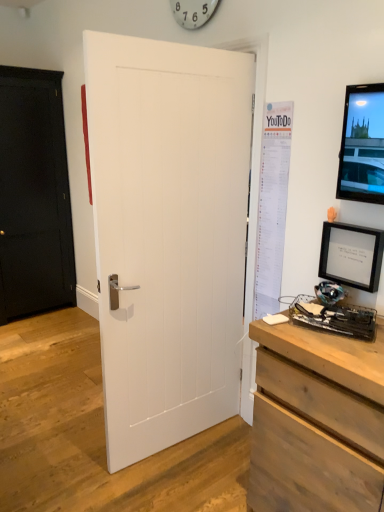
What are the coordinates of `vacant area that lies in front of white matte notepad at center` in the screenshot? It's located at (292, 338).